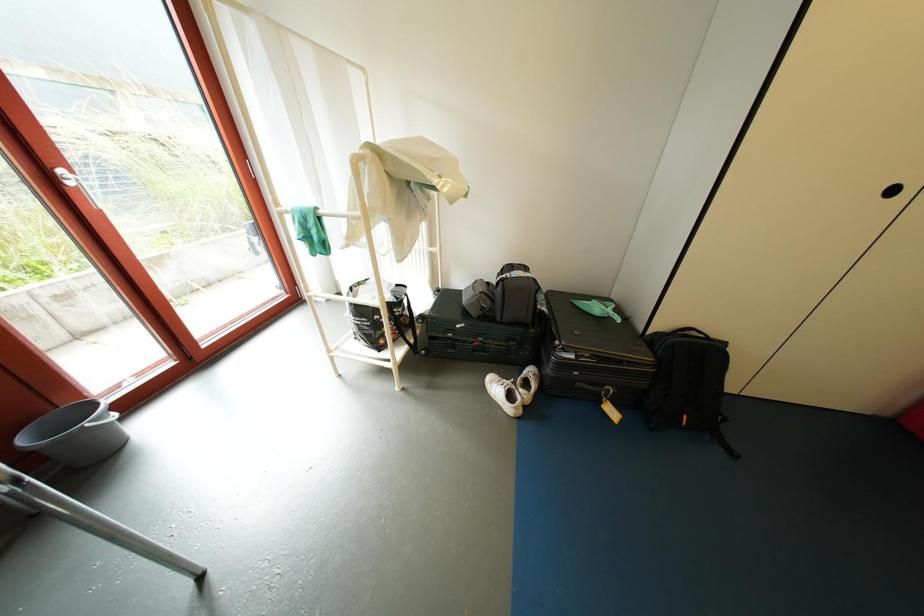
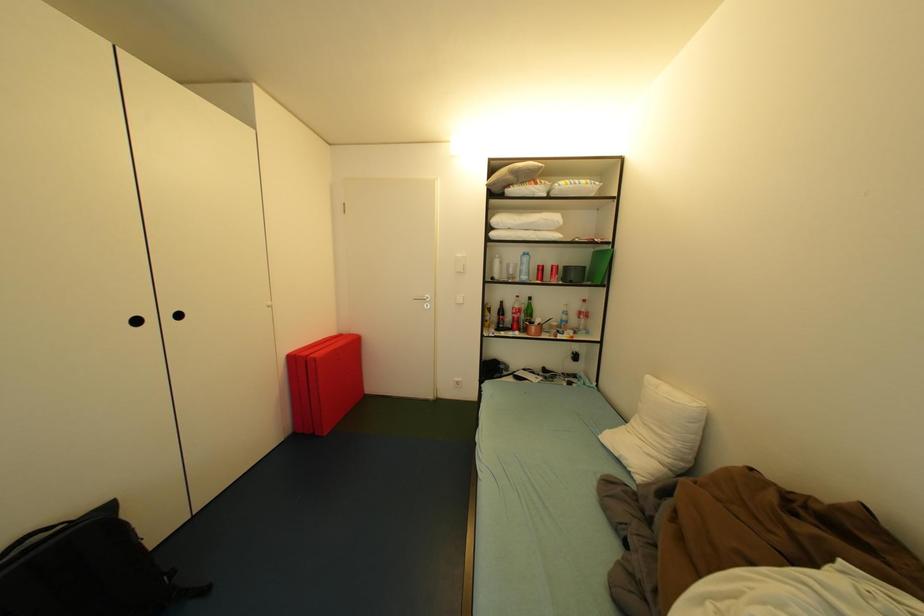
Question: Based on the continuous images, in which direction is the camera rotating? Reply with the corresponding letter.

Choices:
 (A) Left
 (B) Right
 (C) Up
 (D) Down

Answer: (B)